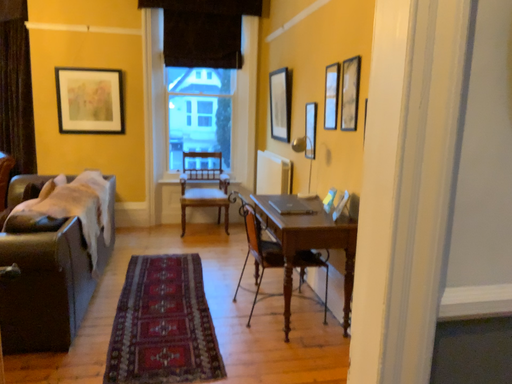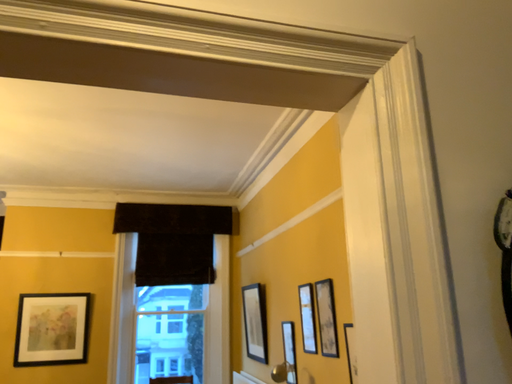
Question: Which way did the camera rotate in the video?

Choices:
 (A) rotated downward
 (B) rotated upward

Answer: (B)